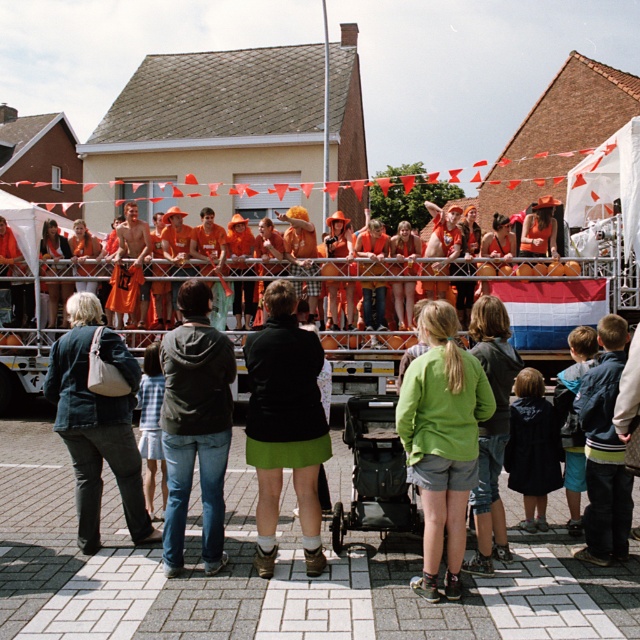
Question: Does dark gray hoodie at center have a larger size compared to green fabric jacket at center?

Choices:
 (A) no
 (B) yes

Answer: (A)

Question: Among these points, which one is farthest from the camera?

Choices:
 (A) (481, 477)
 (B) (198, 476)
 (C) (92, 536)
 (D) (454, 440)

Answer: (C)

Question: Which point appears farthest from the camera in this image?

Choices:
 (A) (316, 538)
 (B) (96, 532)
 (C) (420, 506)

Answer: (C)

Question: Based on their relative distances, which object is farther from the green fabric shorts at center?

Choices:
 (A) denim jacket at center
 (B) green skirt at center
 (C) green fabric jacket at center

Answer: (A)

Question: Observing the image, what is the correct spatial positioning of dark gray hoodie at center in reference to green fabric jacket at center?

Choices:
 (A) left
 (B) right

Answer: (A)

Question: Does dark gray hoodie at center have a greater width compared to green fabric jacket at center?

Choices:
 (A) yes
 (B) no

Answer: (A)